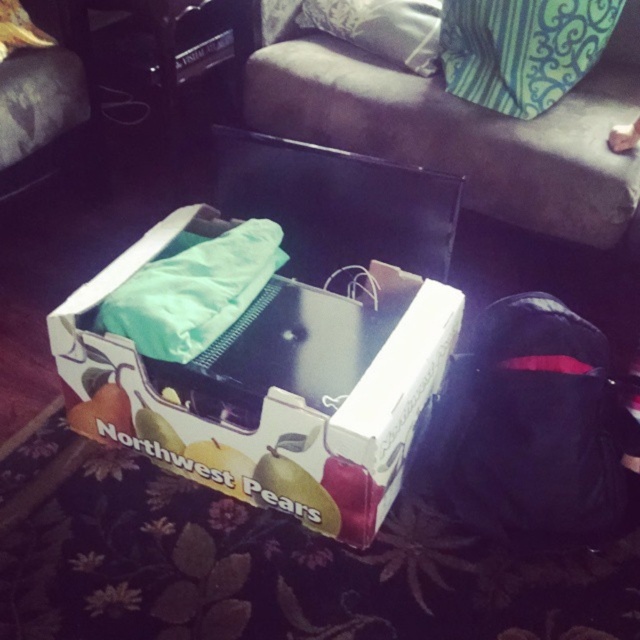
Who is positioned more to the left, dark fabric couch at upper center or blue-green fabric pillow at upper center?

Positioned to the left is dark fabric couch at upper center.

You are a GUI agent. You are given a task and a screenshot of the screen. Output one action in this format:
    pyautogui.click(x=<x>, y=<y>)
    Task: Click on the dark fabric couch at upper center
    Image resolution: width=640 pixels, height=640 pixels.
    Given the screenshot: What is the action you would take?
    pyautogui.click(x=467, y=131)

Is white cardboard box at center taller than blue-green fabric pillow at upper center?

Yes, white cardboard box at center is taller than blue-green fabric pillow at upper center.

Which is more to the right, white cardboard box at center or blue-green fabric pillow at upper center?

blue-green fabric pillow at upper center is more to the right.

The image size is (640, 640). I want to click on white cardboard box at center, so (x=269, y=387).

The height and width of the screenshot is (640, 640). Find the location of `white cardboard box at center`. white cardboard box at center is located at coordinates (269, 387).

Describe the element at coordinates (337, 204) in the screenshot. Image resolution: width=640 pixels, height=640 pixels. I see `matte black laptop at center` at that location.

Which is in front, point (436, 275) or point (352, 13)?

Positioned in front is point (436, 275).

Which is in front, point (392, 170) or point (308, 12)?

Point (392, 170)

You are a GUI agent. You are given a task and a screenshot of the screen. Output one action in this format:
    pyautogui.click(x=<x>, y=<y>)
    Task: Click on the matte black laptop at center
    
    Given the screenshot: What is the action you would take?
    pyautogui.click(x=337, y=204)